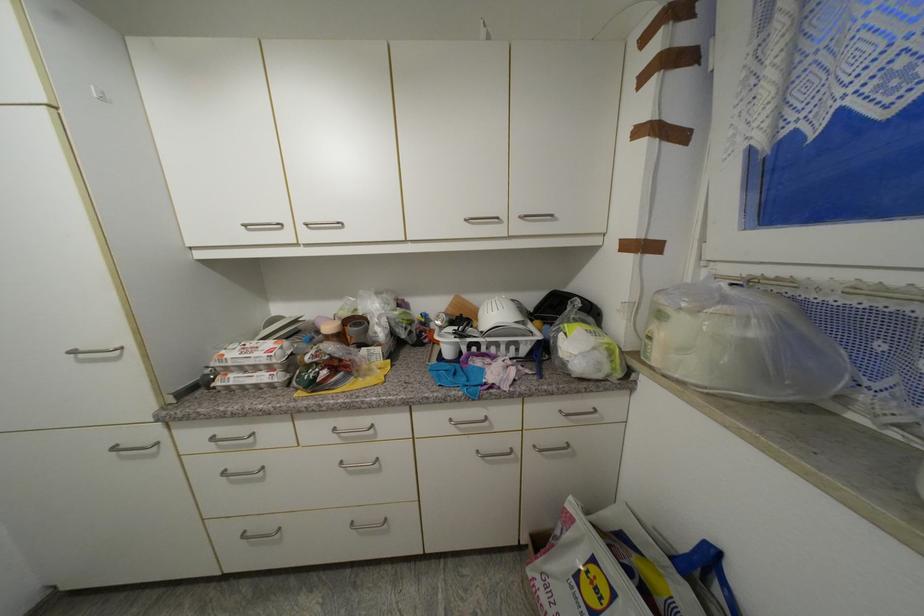
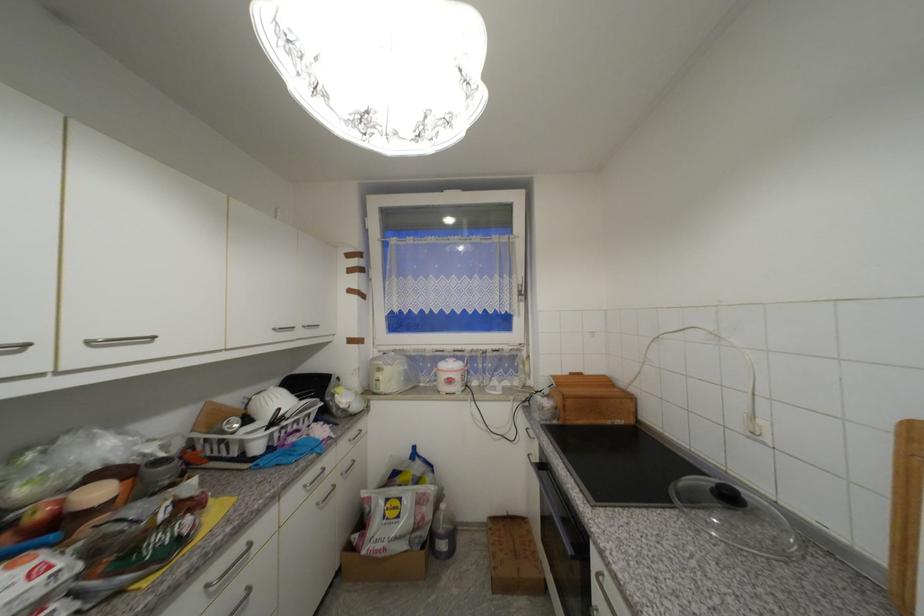
The point at (x=341, y=430) is marked in the first image. Where is the corresponding point in the second image?

(213, 588)